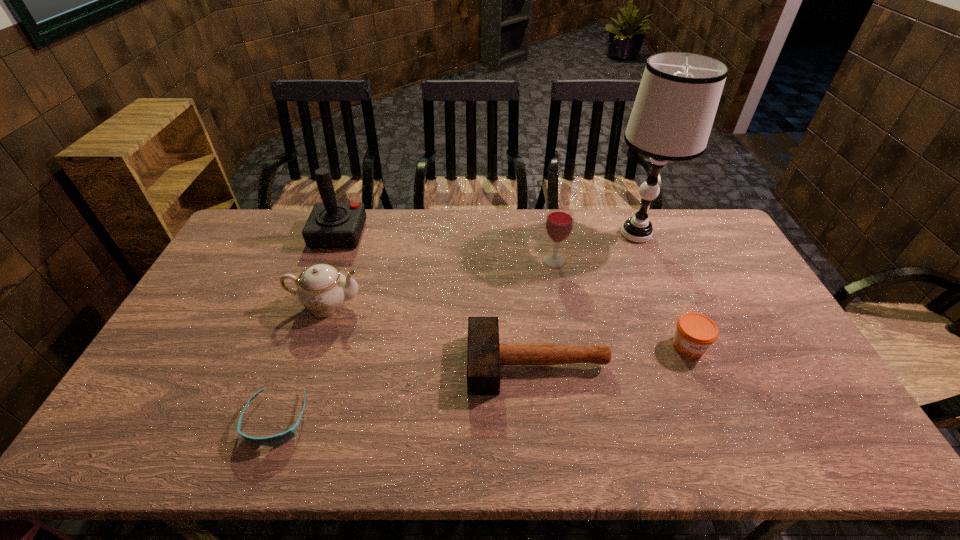
At what (x,y) coordinates should I click in order to perform the action: click on vacant point located between the table lamp and the fifth shortest object. Please return your answer as a coordinate pair (x, y). The image size is (960, 540). Looking at the image, I should click on (595, 247).

In order to click on the closest object to the wineglass in this screenshot , I will do `click(673, 113)`.

Locate which object is the closest to the wineglass. Please provide its 2D coordinates. Your answer should be formatted as a tuple, i.e. [(x, y)], where the tuple contains the x and y coordinates of a point satisfying the conditions above.

[(673, 113)]

Where is `blank space that satisfies the following two spatial constraints: 1. at the spout of the fourth farthest object; 2. on the front-facing side of the sunglasses`? This screenshot has height=540, width=960. blank space that satisfies the following two spatial constraints: 1. at the spout of the fourth farthest object; 2. on the front-facing side of the sunglasses is located at coordinates (287, 420).